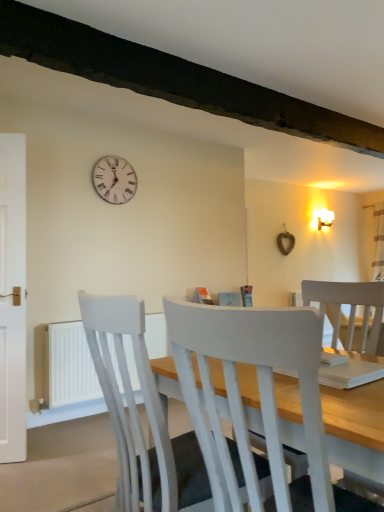
This screenshot has height=512, width=384. What do you see at coordinates (114, 179) in the screenshot?
I see `white wooden clock at upper center` at bounding box center [114, 179].

Where is `white painted wood chair at center, placed as the second chair when sorted from back to front`? The image size is (384, 512). white painted wood chair at center, placed as the second chair when sorted from back to front is located at coordinates (259, 393).

The width and height of the screenshot is (384, 512). In order to click on white painted wood chair at center, which is the first chair in back-to-front order in this screenshot , I will do `click(138, 418)`.

Based on their sizes in the image, would you say white painted wood chair at center, placed as the second chair when sorted from back to front, is bigger or smaller than white painted wood chair at center, the second chair from the front?

In the image, white painted wood chair at center, placed as the second chair when sorted from back to front, appears to be smaller than white painted wood chair at center, the second chair from the front.

From the image's perspective, which one is positioned higher, white painted wood chair at center, marked as the first chair in a front-to-back arrangement, or white painted wood chair at center, the second chair from the front?

white painted wood chair at center, marked as the first chair in a front-to-back arrangement.

Looking at this image, between white painted wood chair at center, marked as the first chair in a front-to-back arrangement, and white painted wood chair at center, which is the first chair in back-to-front order, which one has smaller width?

With smaller width is white painted wood chair at center, marked as the first chair in a front-to-back arrangement.

Based on the photo, considering the positions of objects white painted wood chair at center, placed as the second chair when sorted from back to front, and white painted wood chair at center, the second chair from the front, in the image provided, who is more to the right, white painted wood chair at center, placed as the second chair when sorted from back to front, or white painted wood chair at center, the second chair from the front,?

Positioned to the right is white painted wood chair at center, placed as the second chair when sorted from back to front.

Considering the positions of point (136, 421) and point (188, 339), is point (136, 421) closer or farther from the camera than point (188, 339)?

Point (136, 421).

Is white painted wood chair at center, the second chair from the front, completely or partially outside of white painted wood chair at center, placed as the second chair when sorted from back to front?

white painted wood chair at center, the second chair from the front, is positioned outside white painted wood chair at center, placed as the second chair when sorted from back to front.

Does white painted wood chair at center, the second chair from the front, touch white painted wood chair at center, placed as the second chair when sorted from back to front?

white painted wood chair at center, the second chair from the front, is not next to white painted wood chair at center, placed as the second chair when sorted from back to front, and they're not touching.

Can you tell me how much white painted wood chair at center, the second chair from the front, and white painted wood chair at center, placed as the second chair when sorted from back to front, differ in facing direction?

The angle between the facing direction of white painted wood chair at center, the second chair from the front, and the facing direction of white painted wood chair at center, placed as the second chair when sorted from back to front, is 0.000182 degrees.

Considering the relative sizes of white painted wood chair at center, the second chair from the front, and white plastic radiator at lower left in the image provided, is white painted wood chair at center, the second chair from the front, thinner than white plastic radiator at lower left?

Incorrect, the width of white painted wood chair at center, the second chair from the front, is not less than that of white plastic radiator at lower left.

Where is `radiator on the left of white painted wood chair at center, which is the first chair in back-to-front order`? The width and height of the screenshot is (384, 512). radiator on the left of white painted wood chair at center, which is the first chair in back-to-front order is located at coordinates (70, 368).

From a real-world perspective, is white painted wood chair at center, which is the first chair in back-to-front order, located beneath white plastic radiator at lower left?

No, from a real-world perspective, white painted wood chair at center, which is the first chair in back-to-front order, is not under white plastic radiator at lower left.

Does white painted wood chair at center, the second chair from the front, have a larger size compared to white plastic radiator at lower left?

Yes, white painted wood chair at center, the second chair from the front, is bigger than white plastic radiator at lower left.

From a real-world perspective, which object rests below the other?

white painted wood chair at center, which is the first chair in back-to-front order.

Is white painted wood chair at center, which is the first chair in back-to-front order, outside of white wooden clock at upper center?

Yes, white painted wood chair at center, which is the first chair in back-to-front order, is located beyond the bounds of white wooden clock at upper center.

Consider the image. What's the angular difference between white painted wood chair at center, which is the first chair in back-to-front order, and white wooden clock at upper center's facing directions?

The facing directions of white painted wood chair at center, which is the first chair in back-to-front order, and white wooden clock at upper center are 90.7 degrees apart.

Between point (132, 423) and point (118, 167), which one is positioned in front?

The point (132, 423) is more forward.

Is white painted wood chair at center, marked as the first chair in a front-to-back arrangement, to the left or to the right of white plastic radiator at lower left in the image?

white painted wood chair at center, marked as the first chair in a front-to-back arrangement, is to the right of white plastic radiator at lower left.

From a real-world perspective, is white painted wood chair at center, marked as the first chair in a front-to-back arrangement, on white plastic radiator at lower left?

Yes, from a real-world perspective, white painted wood chair at center, marked as the first chair in a front-to-back arrangement, is on top of white plastic radiator at lower left.

Is white painted wood chair at center, placed as the second chair when sorted from back to front, further to camera compared to white plastic radiator at lower left?

No, it is in front of white plastic radiator at lower left.

Which object is wider, white painted wood chair at center, placed as the second chair when sorted from back to front, or white plastic radiator at lower left?

Wider between the two is white painted wood chair at center, placed as the second chair when sorted from back to front.

From a real-world perspective, is white painted wood chair at center, placed as the second chair when sorted from back to front, physically above white wooden clock at upper center?

Incorrect, from a real-world perspective, white painted wood chair at center, placed as the second chair when sorted from back to front, is lower than white wooden clock at upper center.

From the image's perspective, is white painted wood chair at center, marked as the first chair in a front-to-back arrangement, above white wooden clock at upper center?

No, from the image's perspective, white painted wood chair at center, marked as the first chair in a front-to-back arrangement, is not on top of white wooden clock at upper center.

In the image, there is a white painted wood chair at center, placed as the second chair when sorted from back to front. Identify the location of wall clock above it (from the image's perspective). (114, 179).

Is white painted wood chair at center, marked as the first chair in a front-to-back arrangement, outside of white wooden clock at upper center?

Indeed, white painted wood chair at center, marked as the first chair in a front-to-back arrangement, is completely outside white wooden clock at upper center.

Is white plastic radiator at lower left oriented towards white painted wood chair at center, the second chair from the front?

Yes, white plastic radiator at lower left faces towards white painted wood chair at center, the second chair from the front.

In terms of size, does white plastic radiator at lower left appear bigger or smaller than white painted wood chair at center, which is the first chair in back-to-front order?

white plastic radiator at lower left is smaller than white painted wood chair at center, which is the first chair in back-to-front order.

Is white plastic radiator at lower left to the left of white painted wood chair at center, which is the first chair in back-to-front order, from the viewer's perspective?

Correct, you'll find white plastic radiator at lower left to the left of white painted wood chair at center, which is the first chair in back-to-front order.

Can you confirm if white plastic radiator at lower left is wider than white painted wood chair at center, the second chair from the front?

Incorrect, the width of white plastic radiator at lower left does not surpass that of white painted wood chair at center, the second chair from the front.

Where is `chair lying above the white painted wood chair at center, which is the first chair in back-to-front order (from the image's perspective)`? This screenshot has width=384, height=512. chair lying above the white painted wood chair at center, which is the first chair in back-to-front order (from the image's perspective) is located at coordinates (259, 393).

This screenshot has width=384, height=512. Identify the location of chair that appears below the white painted wood chair at center, placed as the second chair when sorted from back to front (from the image's perspective). (138, 418).

When comparing their distances from white painted wood chair at center, placed as the second chair when sorted from back to front, does white painted wood chair at center, which is the first chair in back-to-front order, or white wooden clock at upper center seem closer?

Based on the image, white painted wood chair at center, which is the first chair in back-to-front order, appears to be nearer to white painted wood chair at center, placed as the second chair when sorted from back to front.

When comparing their distances from white painted wood chair at center, placed as the second chair when sorted from back to front, does white plastic radiator at lower left or white painted wood chair at center, the second chair from the front, seem closer?

white painted wood chair at center, the second chair from the front, is closer to white painted wood chair at center, placed as the second chair when sorted from back to front.

When comparing their distances from white plastic radiator at lower left, does white painted wood chair at center, marked as the first chair in a front-to-back arrangement, or white painted wood chair at center, which is the first chair in back-to-front order, seem further?

Based on the image, white painted wood chair at center, marked as the first chair in a front-to-back arrangement, appears to be further to white plastic radiator at lower left.

From the image, which object appears to be farther from white wooden clock at upper center, white painted wood chair at center, marked as the first chair in a front-to-back arrangement, or white painted wood chair at center, which is the first chair in back-to-front order?

white painted wood chair at center, marked as the first chair in a front-to-back arrangement, is further to white wooden clock at upper center.

Considering their positions, is white wooden clock at upper center positioned further to white painted wood chair at center, placed as the second chair when sorted from back to front, than white painted wood chair at center, the second chair from the front?

Based on the image, white wooden clock at upper center appears to be further to white painted wood chair at center, placed as the second chair when sorted from back to front.

From the image, which object appears to be nearer to white plastic radiator at lower left, white painted wood chair at center, the second chair from the front, or white painted wood chair at center, placed as the second chair when sorted from back to front?

The object closer to white plastic radiator at lower left is white painted wood chair at center, the second chair from the front.

Estimate the real-world distances between objects in this image. Which object is closer to white wooden clock at upper center, white painted wood chair at center, placed as the second chair when sorted from back to front, or white plastic radiator at lower left?

Based on the image, white plastic radiator at lower left appears to be nearer to white wooden clock at upper center.

When comparing their distances from white plastic radiator at lower left, does white wooden clock at upper center or white painted wood chair at center, marked as the first chair in a front-to-back arrangement, seem further?

white painted wood chair at center, marked as the first chair in a front-to-back arrangement, lies further to white plastic radiator at lower left than the other object.

Image resolution: width=384 pixels, height=512 pixels. Identify the location of radiator between white painted wood chair at center, placed as the second chair when sorted from back to front, and white wooden clock at upper center, along the z-axis. (70, 368).

Locate an element on the screen. This screenshot has height=512, width=384. chair located between white painted wood chair at center, placed as the second chair when sorted from back to front, and white plastic radiator at lower left in the depth direction is located at coordinates tap(138, 418).

Locate an element on the screen. The width and height of the screenshot is (384, 512). chair between white painted wood chair at center, marked as the first chair in a front-to-back arrangement, and white wooden clock at upper center, along the z-axis is located at coordinates (138, 418).

The width and height of the screenshot is (384, 512). What are the coordinates of `radiator between white painted wood chair at center, which is the first chair in back-to-front order, and white wooden clock at upper center, along the z-axis` in the screenshot? It's located at (70, 368).